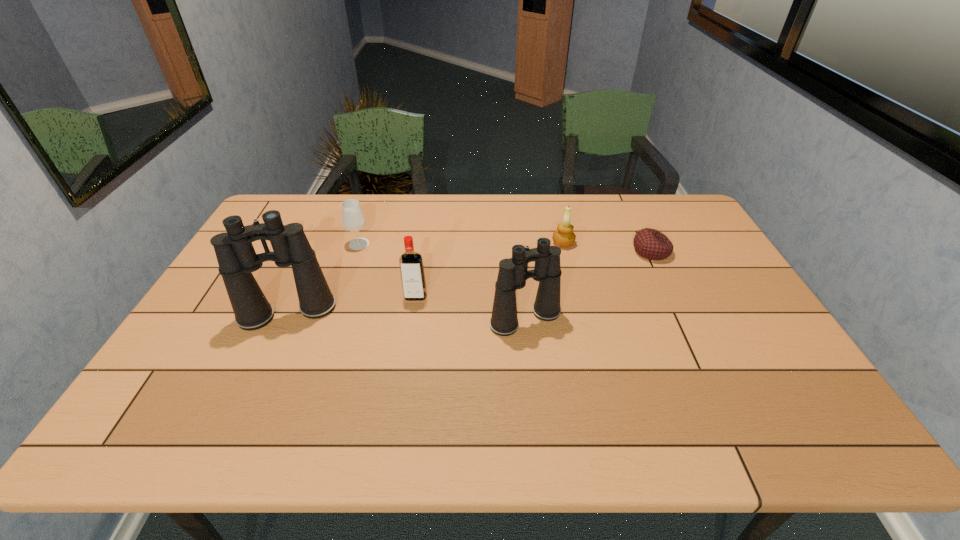
The height and width of the screenshot is (540, 960). I want to click on the tallest object, so click(237, 259).

Where is `the taller binoculars`? Image resolution: width=960 pixels, height=540 pixels. the taller binoculars is located at coordinates (237, 259).

You are a GUI agent. You are given a task and a screenshot of the screen. Output one action in this format:
    pyautogui.click(x=<x>, y=<y>)
    Task: Click on the right binoculars
    Image resolution: width=960 pixels, height=540 pixels.
    Given the screenshot: What is the action you would take?
    pyautogui.click(x=513, y=273)

Locate an element on the screen. The height and width of the screenshot is (540, 960). the fifth shortest object is located at coordinates (513, 273).

Where is `candle_holder`? This screenshot has width=960, height=540. candle_holder is located at coordinates (564, 236).

Image resolution: width=960 pixels, height=540 pixels. What are the coordinates of `beanbag` in the screenshot? It's located at (651, 244).

This screenshot has height=540, width=960. Find the location of `the rightmost object`. the rightmost object is located at coordinates (651, 244).

Locate an element on the screen. The height and width of the screenshot is (540, 960). glass is located at coordinates (354, 220).

Where is `the fourth shortest object`? the fourth shortest object is located at coordinates (411, 265).

This screenshot has width=960, height=540. What are the coordinates of `vodka` in the screenshot? It's located at (411, 265).